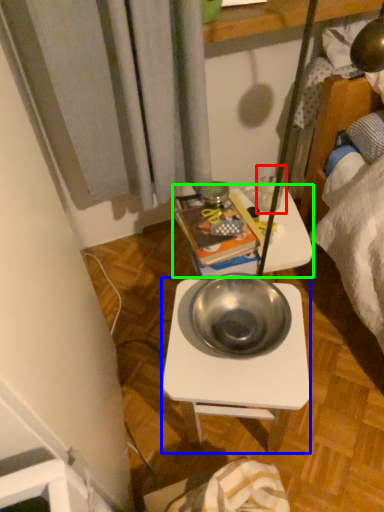
Question: Based on their relative distances, which object is farther from coffee cup (highlighted by a red box)? Choose from desk (highlighted by a blue box) and table (highlighted by a green box).

Choices:
 (A) desk
 (B) table

Answer: (A)